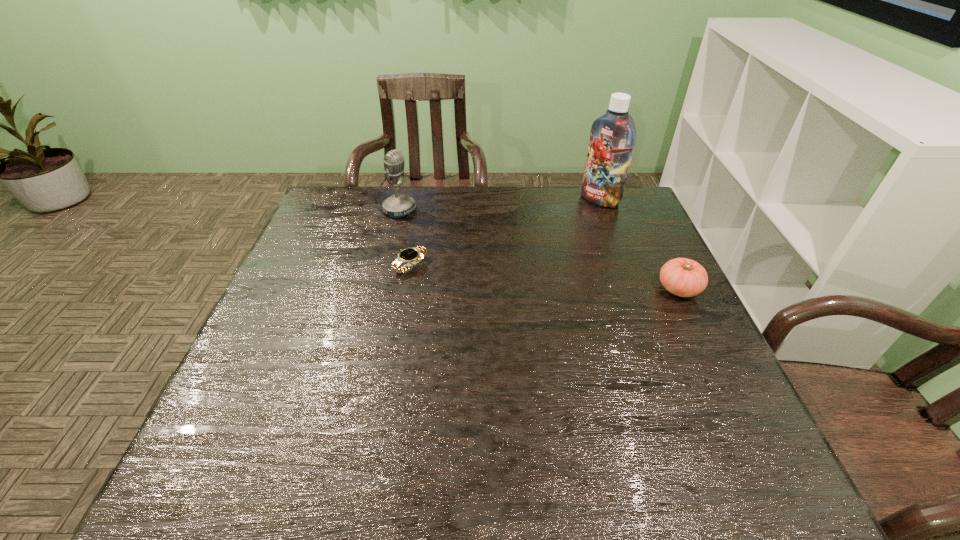
What are the coordinates of `vacant region located on the front-facing side of the microphone` in the screenshot? It's located at (474, 253).

Find the location of a particular element. This screenshot has width=960, height=540. vacant region located on the front label of the second object from right to left is located at coordinates (566, 225).

Where is `free region located 0.320m on the front label of the second object from right to left`? free region located 0.320m on the front label of the second object from right to left is located at coordinates (531, 253).

The image size is (960, 540). What are the coordinates of `free space located on the front label of the second object from right to left` in the screenshot? It's located at (524, 259).

In order to click on microphone at the far edge in this screenshot , I will do `click(398, 205)`.

Where is `shampoo located in the far edge section of the desktop`? This screenshot has width=960, height=540. shampoo located in the far edge section of the desktop is located at coordinates (612, 136).

Identify the location of tomato that is at the right edge. [683, 277].

Find the location of a particular element. The image size is (960, 540). shampoo that is at the right edge is located at coordinates (612, 136).

Identify the location of object at the far right corner. (612, 136).

Where is `vacant space at the far edge`? The image size is (960, 540). vacant space at the far edge is located at coordinates (577, 223).